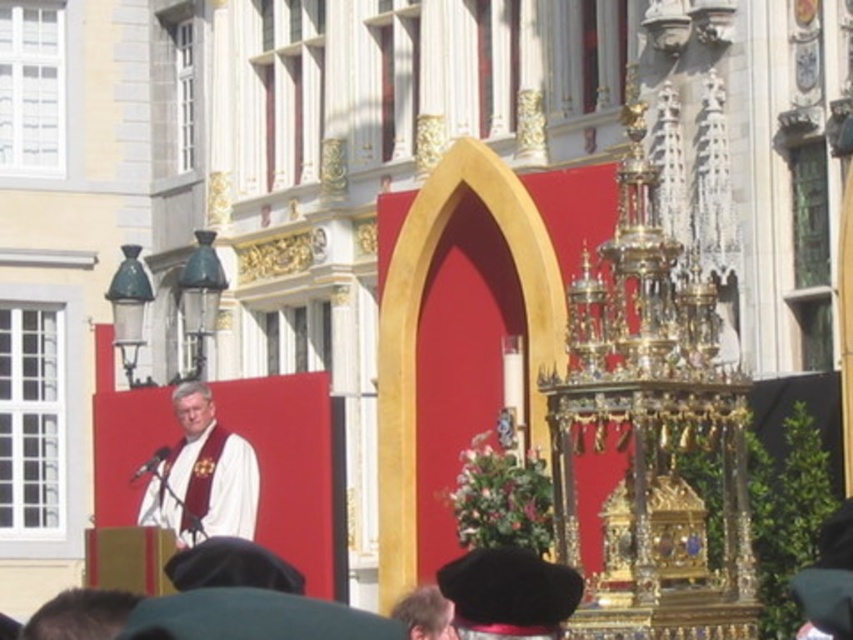
Is white cloth at center positioned at the back of black felt hat at lower center?

Yes, it is.

Can you confirm if white cloth at center is shorter than black felt hat at lower center?

Yes.

Image resolution: width=853 pixels, height=640 pixels. Describe the element at coordinates (202, 476) in the screenshot. I see `white cloth at center` at that location.

I want to click on white cloth at center, so click(x=202, y=476).